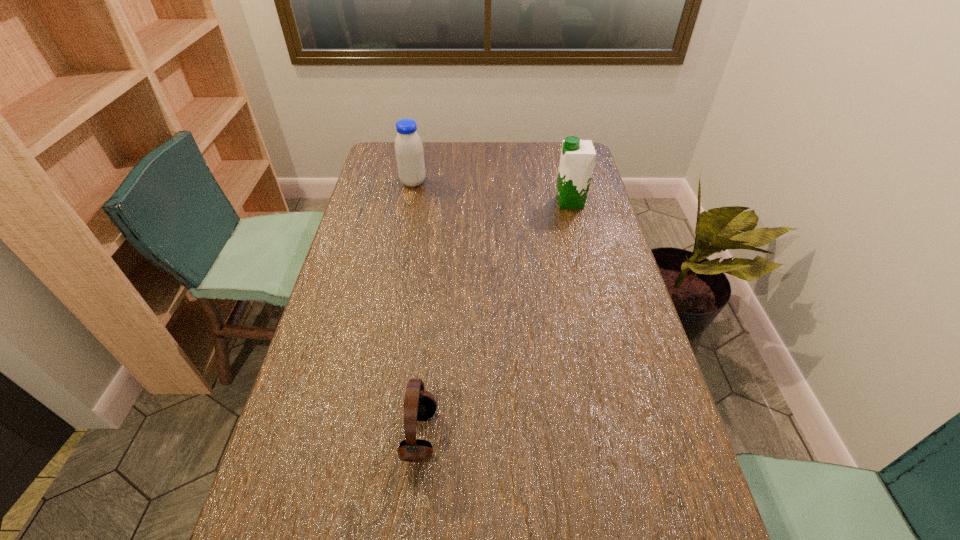
At what (x,y) coordinates should I click in order to perform the action: click on vacant space located 0.400m on the ear pads of the shortest object. Please return your answer as a coordinate pair (x, y). The height and width of the screenshot is (540, 960). Looking at the image, I should click on (614, 435).

Identify the location of object that is at the left edge. (409, 152).

The image size is (960, 540). In order to click on object at the right edge in this screenshot , I will do `click(577, 159)`.

Image resolution: width=960 pixels, height=540 pixels. Find the location of `free location at the far edge of the desktop`. free location at the far edge of the desktop is located at coordinates (521, 170).

Image resolution: width=960 pixels, height=540 pixels. In the image, there is a desktop. What are the coordinates of `vacant space at the left edge` in the screenshot? It's located at (348, 265).

The height and width of the screenshot is (540, 960). In the image, there is a desktop. What are the coordinates of `vacant region at the right edge` in the screenshot? It's located at (650, 403).

At what (x,y) coordinates should I click in order to perform the action: click on vacant space at the far right corner of the desktop. Please return your answer as a coordinate pair (x, y). The width and height of the screenshot is (960, 540). Looking at the image, I should click on (551, 150).

Identify the location of vacant space that is in between the farthest object and the rightmost object. (492, 192).

Where is `vacant area that lies between the left soya milk and the second farthest object`? Image resolution: width=960 pixels, height=540 pixels. vacant area that lies between the left soya milk and the second farthest object is located at coordinates (492, 192).

The width and height of the screenshot is (960, 540). Find the location of `free spot between the nearer soya milk and the shortest object`. free spot between the nearer soya milk and the shortest object is located at coordinates (494, 319).